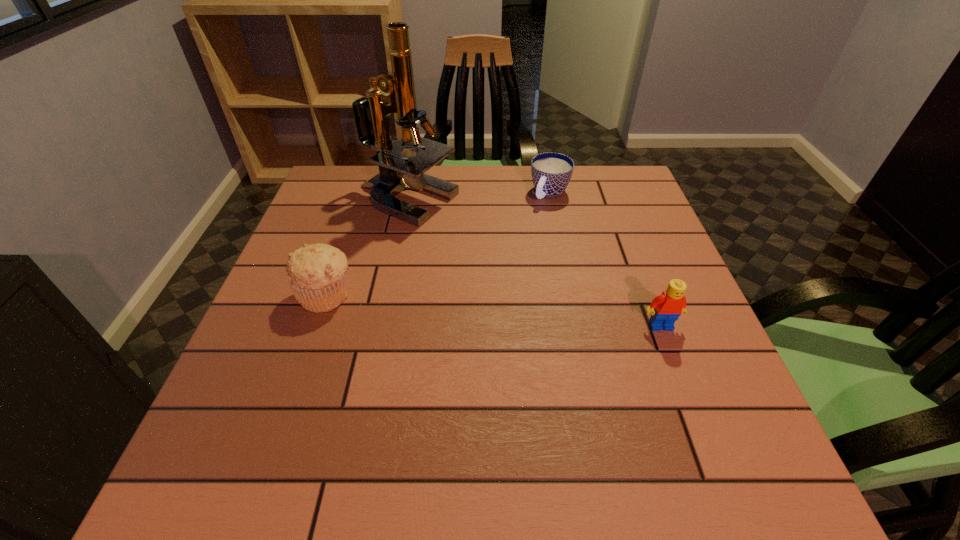
This screenshot has width=960, height=540. In order to click on vacant point located between the shortest object and the muffin in this screenshot , I will do `click(439, 244)`.

Where is `vacant space in between the nearest object and the muffin`? vacant space in between the nearest object and the muffin is located at coordinates (493, 310).

I want to click on free point between the microscope and the nearest object, so click(x=534, y=264).

The height and width of the screenshot is (540, 960). I want to click on free area in between the third farthest object and the tallest object, so click(367, 248).

You are a GUI agent. You are given a task and a screenshot of the screen. Output one action in this format:
    pyautogui.click(x=<x>, y=<y>)
    Task: Click on the vacant space in between the muffin and the microscope
    The width and height of the screenshot is (960, 540).
    Given the screenshot: What is the action you would take?
    pyautogui.click(x=367, y=248)

At what (x,y) coordinates should I click in order to perform the action: click on free space between the microscope and the rightmost object. Please return your answer as a coordinate pair (x, y). The height and width of the screenshot is (540, 960). Looking at the image, I should click on (534, 264).

Locate an element on the screen. The height and width of the screenshot is (540, 960). vacant space that's between the rightmost object and the third farthest object is located at coordinates [493, 310].

The image size is (960, 540). Find the location of `vacant space in between the microscope and the muffin`. vacant space in between the microscope and the muffin is located at coordinates (367, 248).

Locate an element on the screen. Image resolution: width=960 pixels, height=540 pixels. object that stands as the closest to the muffin is located at coordinates (397, 172).

Identify which object is located as the nearest to the tallest object. Please provide its 2D coordinates. Your answer should be formatted as a tuple, i.e. [(x, y)], where the tuple contains the x and y coordinates of a point satisfying the conditions above.

[(317, 273)]